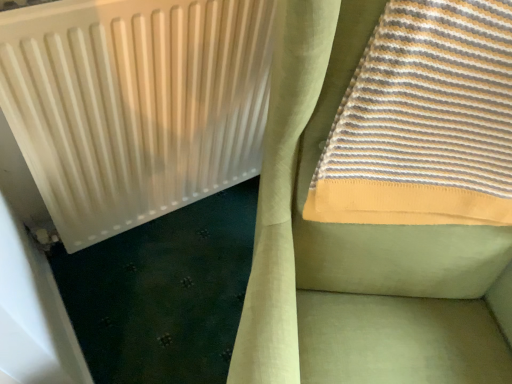
Locate an element on the screen. white matte radiator at upper left is located at coordinates (135, 105).

Image resolution: width=512 pixels, height=384 pixels. Describe the element at coordinates (135, 105) in the screenshot. I see `white matte radiator at upper left` at that location.

Image resolution: width=512 pixels, height=384 pixels. What do you see at coordinates (424, 121) in the screenshot?
I see `striped cotton towel at upper right` at bounding box center [424, 121].

Where is `striped cotton towel at upper right`? The image size is (512, 384). striped cotton towel at upper right is located at coordinates (424, 121).

The width and height of the screenshot is (512, 384). I want to click on white matte radiator at upper left, so click(x=135, y=105).

Would you say striped cotton towel at upper right is to the left or to the right of white matte radiator at upper left in the picture?

striped cotton towel at upper right is positioned on white matte radiator at upper left's right side.

Does striped cotton towel at upper right lie behind white matte radiator at upper left?

No, it is not.

Considering the positions of point (441, 96) and point (8, 20), is point (441, 96) closer or farther from the camera than point (8, 20)?

Point (441, 96) appears to be farther away from the viewer than point (8, 20).

From the image's perspective, is striped cotton towel at upper right below white matte radiator at upper left?

No, from the image's perspective, striped cotton towel at upper right is not below white matte radiator at upper left.

From a real-world perspective, between striped cotton towel at upper right and white matte radiator at upper left, who is vertically lower?

In real-world perspective, white matte radiator at upper left is lower.

In terms of width, does striped cotton towel at upper right look wider or thinner when compared to white matte radiator at upper left?

In the image, striped cotton towel at upper right appears to be wider than white matte radiator at upper left.

Between striped cotton towel at upper right and white matte radiator at upper left, which one has less height?

striped cotton towel at upper right.

Can you confirm if striped cotton towel at upper right is bigger than white matte radiator at upper left?

Indeed, striped cotton towel at upper right has a larger size compared to white matte radiator at upper left.

Would you say striped cotton towel at upper right contains white matte radiator at upper left?

No, white matte radiator at upper left is located outside of striped cotton towel at upper right.

Is there a large distance between striped cotton towel at upper right and white matte radiator at upper left?

No, there isn't a large distance between striped cotton towel at upper right and white matte radiator at upper left.

Is striped cotton towel at upper right positioned with its back to white matte radiator at upper left?

No, striped cotton towel at upper right is not facing away from white matte radiator at upper left.

What's the angular difference between striped cotton towel at upper right and white matte radiator at upper left's facing directions?

33.2 degrees separate the facing orientations of striped cotton towel at upper right and white matte radiator at upper left.

Find the location of a particular element. The height and width of the screenshot is (384, 512). radiator to the left of striped cotton towel at upper right is located at coordinates [x=135, y=105].

Which is more to the left, white matte radiator at upper left or striped cotton towel at upper right?

Positioned to the left is white matte radiator at upper left.

Considering their positions, is white matte radiator at upper left located in front of or behind striped cotton towel at upper right?

Clearly, white matte radiator at upper left is behind striped cotton towel at upper right.

Does point (19, 76) appear closer or farther from the camera than point (454, 63)?

Point (19, 76).

Based on the photo, from the image's perspective, would you say white matte radiator at upper left is positioned over striped cotton towel at upper right?

No, from the image's perspective, white matte radiator at upper left is not over striped cotton towel at upper right.

From a real-world perspective, is white matte radiator at upper left physically located above or below striped cotton towel at upper right?

white matte radiator at upper left is situated lower than striped cotton towel at upper right in the real world.

Can you confirm if white matte radiator at upper left is thinner than striped cotton towel at upper right?

Yes, white matte radiator at upper left is thinner than striped cotton towel at upper right.

From their relative heights in the image, would you say white matte radiator at upper left is taller or shorter than striped cotton towel at upper right?

Considering their sizes, white matte radiator at upper left has more height than striped cotton towel at upper right.

Is white matte radiator at upper left smaller than striped cotton towel at upper right?

Yes.

Does white matte radiator at upper left contain striped cotton towel at upper right?

No.

Is white matte radiator at upper left next to striped cotton towel at upper right?

No, white matte radiator at upper left is not next to striped cotton towel at upper right.

Is striped cotton towel at upper right at the back of white matte radiator at upper left?

white matte radiator at upper left does not have its back to striped cotton towel at upper right.

Looking at this image, can you tell me how much white matte radiator at upper left and striped cotton towel at upper right differ in facing direction?

33.2 degrees separate the facing orientations of white matte radiator at upper left and striped cotton towel at upper right.

I want to click on towel in front of the white matte radiator at upper left, so pyautogui.click(x=424, y=121).

At what (x,y) coordinates should I click in order to perform the action: click on towel that is above the white matte radiator at upper left (from the image's perspective). Please return your answer as a coordinate pair (x, y). This screenshot has height=384, width=512. Looking at the image, I should click on (424, 121).

Locate an element on the screen. Image resolution: width=512 pixels, height=384 pixels. radiator below the striped cotton towel at upper right (from the image's perspective) is located at coordinates (135, 105).